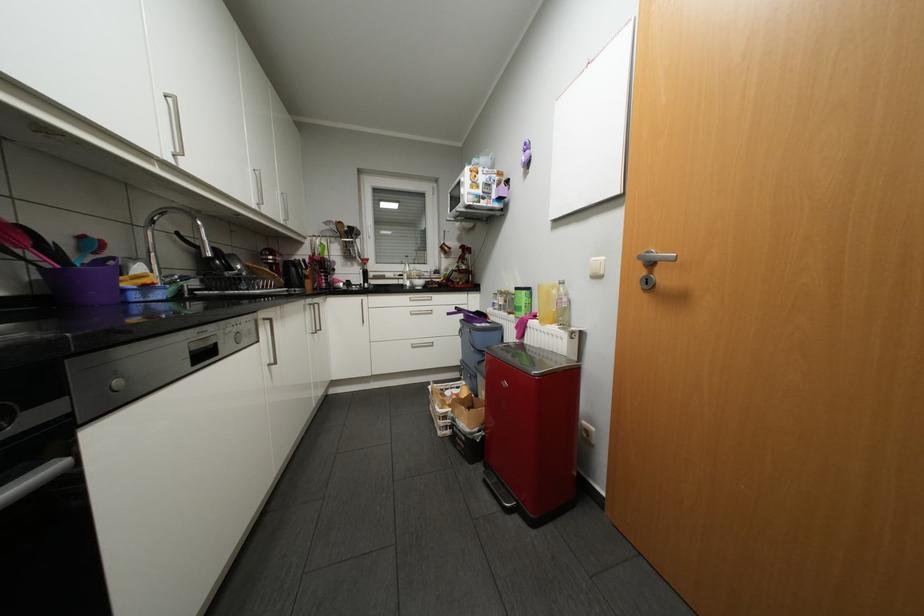
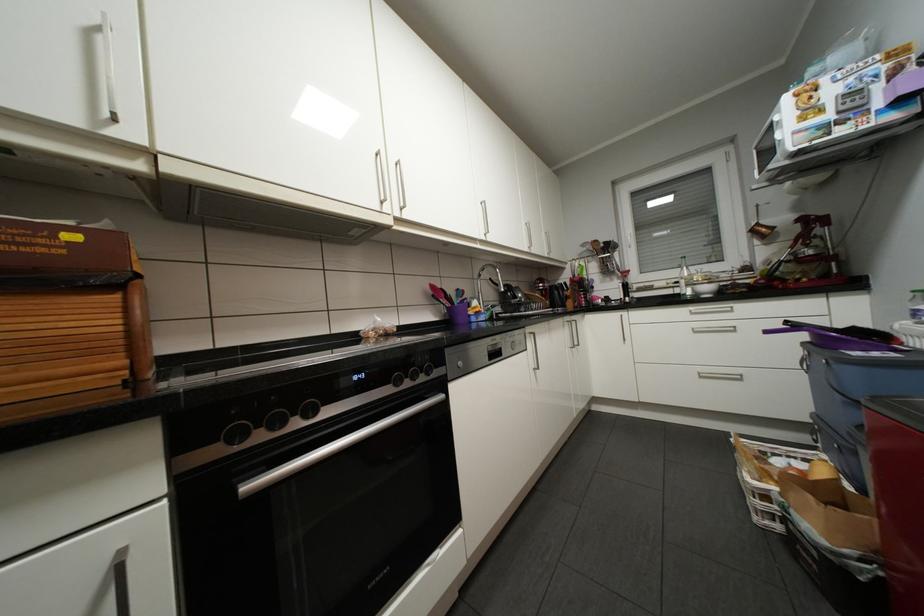
In the second image, find the point that corresponds to [456,313] in the first image.

(775, 331)